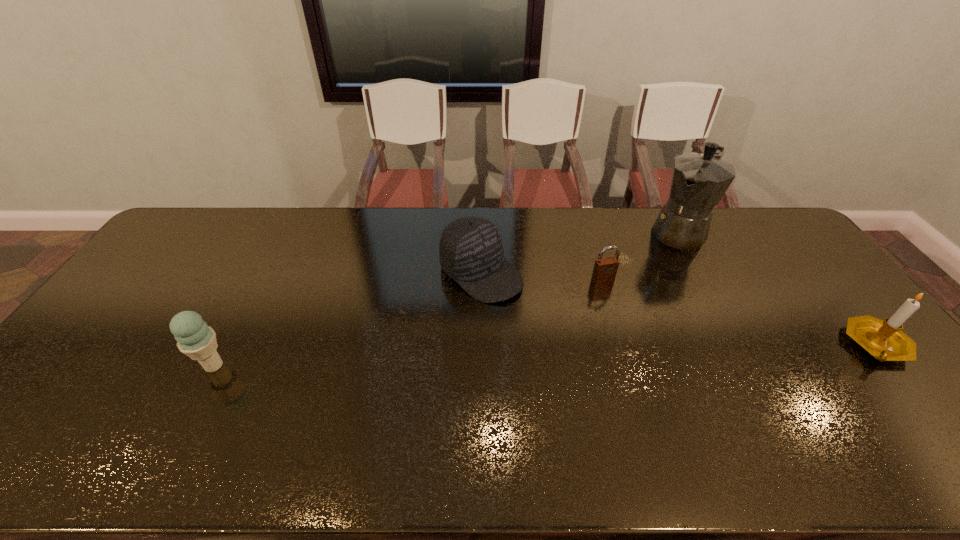
This screenshot has height=540, width=960. Find the location of `object that is at the right edge`. object that is at the right edge is located at coordinates pos(884,340).

Where is `vacant space at the far edge of the desktop`? The width and height of the screenshot is (960, 540). vacant space at the far edge of the desktop is located at coordinates (258, 212).

Find the location of a particular element. The width and height of the screenshot is (960, 540). vacant position at the near edge of the desktop is located at coordinates (731, 403).

Locate an element on the screen. free space at the left edge of the desktop is located at coordinates (137, 280).

Find the location of a particular element. vacant area that lies between the shortest object and the leftmost object is located at coordinates (408, 323).

Identify the location of vacant region between the rightmost object and the shortest object. (739, 312).

What are the coordinates of `vacant area that lies between the ice cream and the candle holder` in the screenshot? It's located at (545, 355).

Where is `vacant area that lies between the padlock and the ice cream`? vacant area that lies between the padlock and the ice cream is located at coordinates (408, 323).

The width and height of the screenshot is (960, 540). Identify the location of free space between the candle holder and the third object from left to right. (739, 312).

Find the location of a particular element. This screenshot has height=540, width=960. free space between the baseball cap and the tallest object is located at coordinates (581, 252).